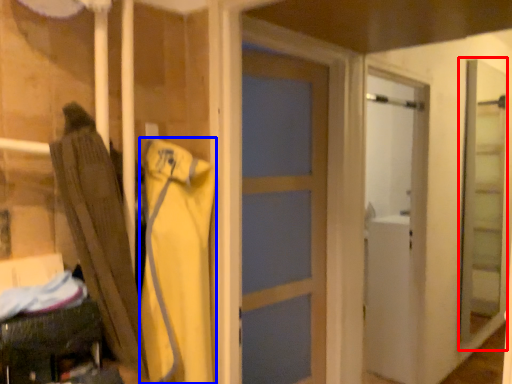
Question: Which object appears closest to the camera in this image, screen door (highlighted by a red box) or clothing (highlighted by a blue box)?

Choices:
 (A) screen door
 (B) clothing

Answer: (B)